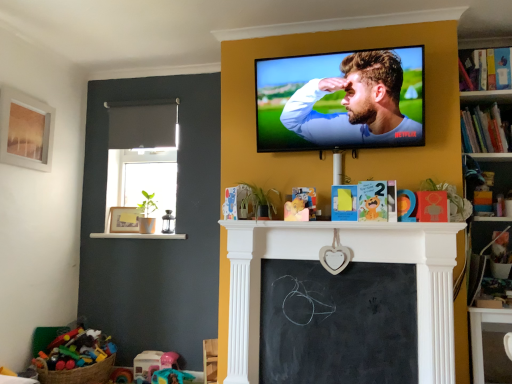
Question: Considering their positions, is hardcover book at upper right, the first book positioned from the bottom, located in front of or behind hardcover book at upper right, the 1th book when ordered from top to bottom?

Choices:
 (A) behind
 (B) front

Answer: (B)

Question: Visually, is hardcover book at upper right, the first book positioned from the bottom, positioned to the left or to the right of hardcover book at upper right, the second book ordered from the bottom?

Choices:
 (A) right
 (B) left

Answer: (B)

Question: Considering the real-world distances, which object is farthest from the matte wooden picture frame at left, which is the 2th picture frame from left to right?

Choices:
 (A) black chalkboard at center
 (B) matte wooden picture frame at upper left, the 1th picture frame from the left
 (C) bright multicolored plastic toys at lower left, the 2th toy positioned from the right
 (D) hardcover book at upper right, the 1th book when ordered from top to bottom
 (E) hardcover book at upper right, the first book positioned from the bottom

Answer: (D)

Question: Which object is positioned farthest from the plastic pink toy at lower center, the first toy when ordered from right to left?

Choices:
 (A) smooth glossy tv at upper center
 (B) hardcover book at upper right, the first book positioned from the bottom
 (C) bright multicolored plastic toys at lower left, the 2th toy positioned from the right
 (D) white glossy ledge at lower left
 (E) black chalkboard at center

Answer: (B)